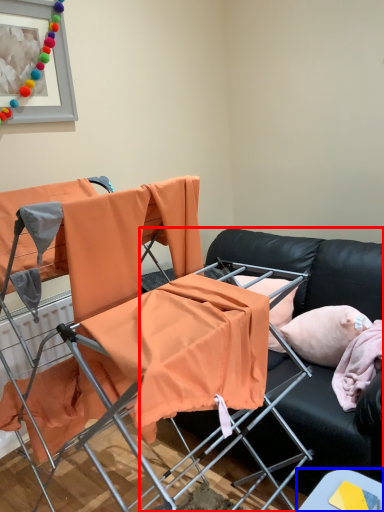
Question: Which of the following is the farthest to the observer, studio couch (highlighted by a red box) or table (highlighted by a blue box)?

Choices:
 (A) studio couch
 (B) table

Answer: (A)